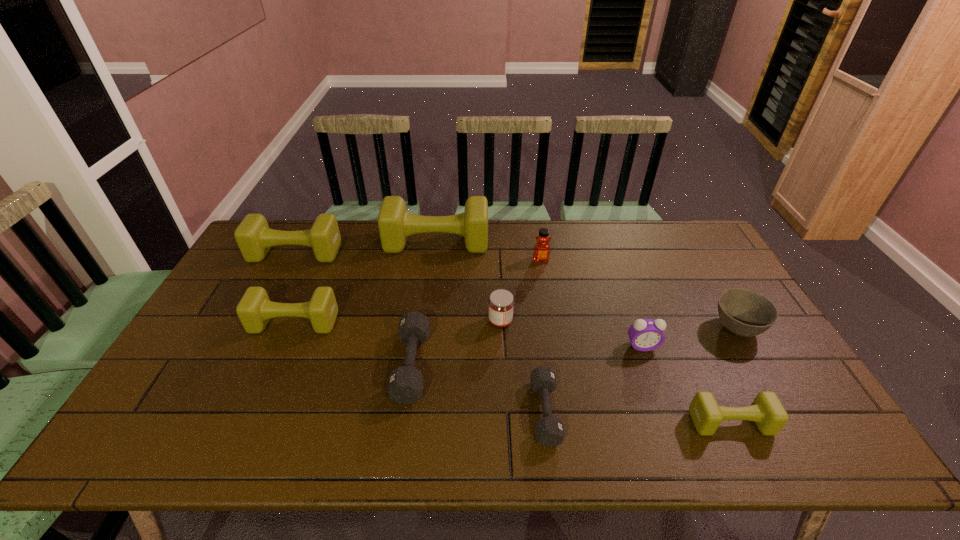
The image size is (960, 540). I want to click on vacant space located 0.180m on the left of the bowl, so click(x=647, y=328).

At what (x,y) coordinates should I click in order to perform the action: click on vacant point located on the right of the left gray dumbbell. Please return your answer as a coordinate pair (x, y). Image resolution: width=960 pixels, height=540 pixels. Looking at the image, I should click on (560, 365).

You are a GUI agent. You are given a task and a screenshot of the screen. Output one action in this format:
    pyautogui.click(x=<x>, y=<y>)
    Task: Click on the free spot located on the left of the smallest olive dumbbell
    Image resolution: width=960 pixels, height=540 pixels.
    Given the screenshot: What is the action you would take?
    pyautogui.click(x=547, y=422)

This screenshot has height=540, width=960. In order to click on free space located on the right of the smaller gray dumbbell in this screenshot , I will do `click(650, 412)`.

I want to click on honey situated at the far edge, so click(x=541, y=253).

Locate an element on the screen. The height and width of the screenshot is (540, 960). bowl positioned at the right edge is located at coordinates (744, 312).

Find the location of `dumbbell at the right edge`. dumbbell at the right edge is located at coordinates (766, 410).

Find the location of a particular element. object positioned at the far left corner is located at coordinates (254, 237).

Find the location of a particular element. object that is at the near right corner is located at coordinates (766, 410).

In the image, there is a desktop. Where is `vacant space at the far edge`? The image size is (960, 540). vacant space at the far edge is located at coordinates (614, 238).